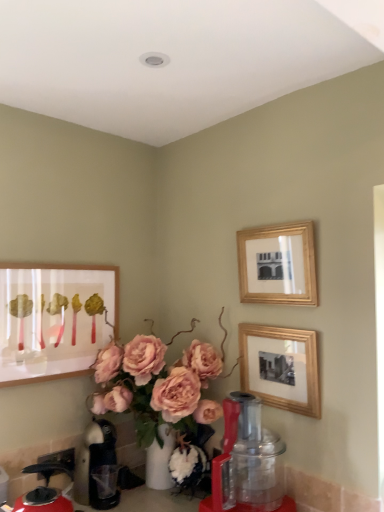
Question: Can red plastic blender at lower center be found inside wooden picture frame at center-right, which is the third picture frame from left to right?

Choices:
 (A) yes
 (B) no

Answer: (B)

Question: Would you consider wooden picture frame at center-right, which is the 1th picture frame from right to left, to be distant from red plastic blender at lower center?

Choices:
 (A) yes
 (B) no

Answer: (B)

Question: Is the position of wooden picture frame at center-right, which is the 1th picture frame from right to left, less distant than that of red plastic blender at lower center?

Choices:
 (A) no
 (B) yes

Answer: (A)

Question: Can you confirm if wooden picture frame at center-right, which is the 1th picture frame from right to left, is wider than red plastic blender at lower center?

Choices:
 (A) no
 (B) yes

Answer: (A)

Question: Does wooden picture frame at center-right, which is the third picture frame from left to right, appear on the right side of red plastic blender at lower center?

Choices:
 (A) yes
 (B) no

Answer: (A)

Question: Is wooden picture frame at center-right, which is the third picture frame from left to right, outside of red plastic blender at lower center?

Choices:
 (A) yes
 (B) no

Answer: (A)

Question: Is matte wooden picture frame at left, which ranks as the third picture frame in right-to-left order, to the right of gold/glass picture frame at upper right, marked as the second picture frame in a left-to-right arrangement, from the viewer's perspective?

Choices:
 (A) yes
 (B) no

Answer: (B)

Question: Does matte wooden picture frame at left, which is counted as the first picture frame, starting from the left, have a greater width compared to gold/glass picture frame at upper right, which ranks as the second picture frame in right-to-left order?

Choices:
 (A) yes
 (B) no

Answer: (B)

Question: Is matte wooden picture frame at left, which is counted as the first picture frame, starting from the left, not close to gold/glass picture frame at upper right, which ranks as the second picture frame in right-to-left order?

Choices:
 (A) no
 (B) yes

Answer: (A)

Question: Considering the relative positions of matte wooden picture frame at left, which ranks as the third picture frame in right-to-left order, and gold/glass picture frame at upper right, which ranks as the second picture frame in right-to-left order, in the image provided, is matte wooden picture frame at left, which ranks as the third picture frame in right-to-left order, behind gold/glass picture frame at upper right, which ranks as the second picture frame in right-to-left order,?

Choices:
 (A) no
 (B) yes

Answer: (B)

Question: Is matte wooden picture frame at left, which is counted as the first picture frame, starting from the left, turned away from gold/glass picture frame at upper right, which ranks as the second picture frame in right-to-left order?

Choices:
 (A) no
 (B) yes

Answer: (A)

Question: From the image's perspective, is matte wooden picture frame at left, which is counted as the first picture frame, starting from the left, on top of gold/glass picture frame at upper right, marked as the second picture frame in a left-to-right arrangement?

Choices:
 (A) no
 (B) yes

Answer: (A)

Question: From a real-world perspective, does wooden picture frame at center-right, which is the 1th picture frame from right to left, stand above matte wooden picture frame at left, which is counted as the first picture frame, starting from the left?

Choices:
 (A) yes
 (B) no

Answer: (B)